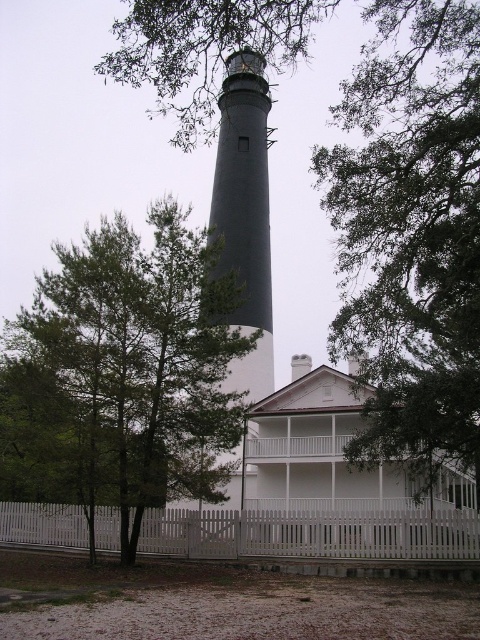
You are standing at the base of the lighthouse and want to walk to the white building with a porch. Which direction should you walk relative to the green leafy tree at left?

You should walk away from the green leafy tree at left since the building is behind the lighthouse, and the tree is on the left side of the lighthouse.

Which object is located at point [123,376]?

The green leafy tree at left is located at point [123,376].